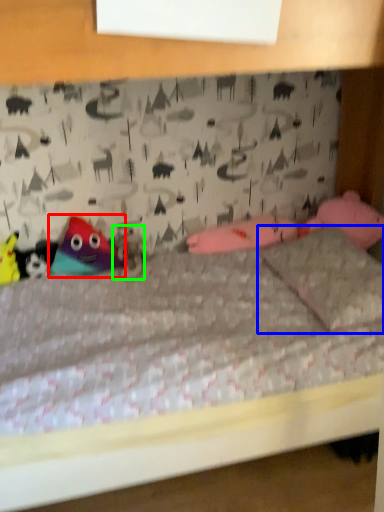
Question: Which object is the farthest from toy (highlighted by a red box)? Choose among these: pillow (highlighted by a blue box) or animal (highlighted by a green box).

Choices:
 (A) pillow
 (B) animal

Answer: (A)